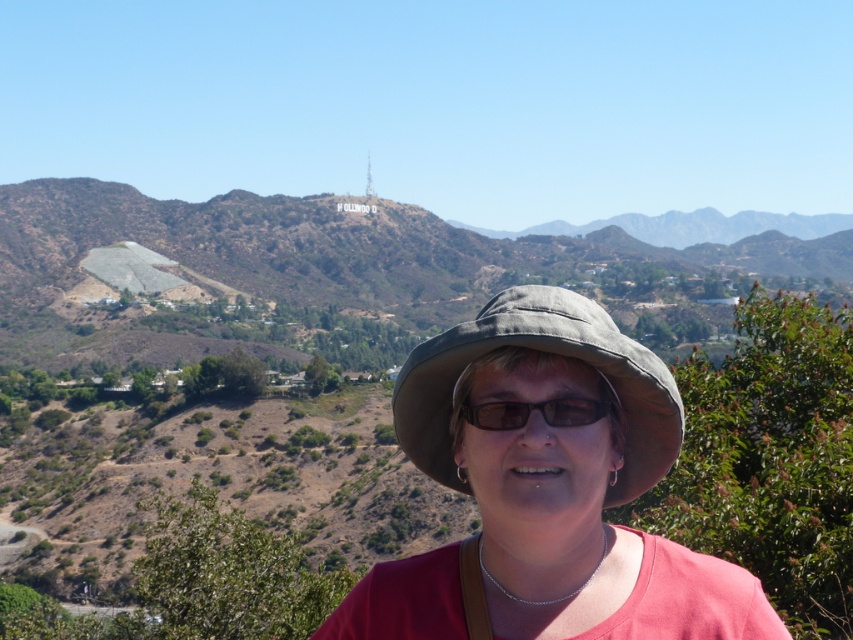
Based on the photo, how distant is matte gray hat at center from gray fabric hat at center?

A distance of 5.65 feet exists between matte gray hat at center and gray fabric hat at center.

From the picture: Between matte gray hat at center and gray fabric hat at center, which one is positioned higher?

gray fabric hat at center is higher up.

In order to click on matte gray hat at center in this screenshot , I will do `click(566, 476)`.

Between green grassy hillside at upper center and brown matte glasses at center, which one appears on the left side from the viewer's perspective?

brown matte glasses at center is more to the left.

Locate an element on the screen. The width and height of the screenshot is (853, 640). green grassy hillside at upper center is located at coordinates point(334,275).

Is point (3, 284) positioned before point (514, 404)?

No, it is behind (514, 404).

Find the location of a particular element. green grassy hillside at upper center is located at coordinates (334, 275).

Is green grassy hillside at upper center below gray fabric hat at center?

No, green grassy hillside at upper center is not below gray fabric hat at center.

Is point (181, 358) positioned behind point (531, 321)?

Yes.

Does point (303, 332) lie behind point (467, 358)?

Yes, it is.

Identify the location of green grassy hillside at upper center. The height and width of the screenshot is (640, 853). (334, 275).